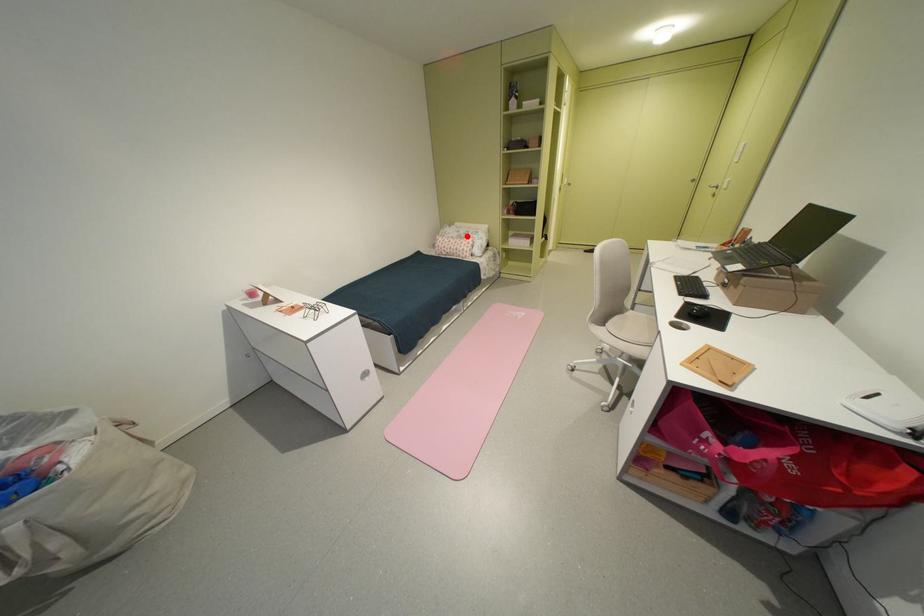
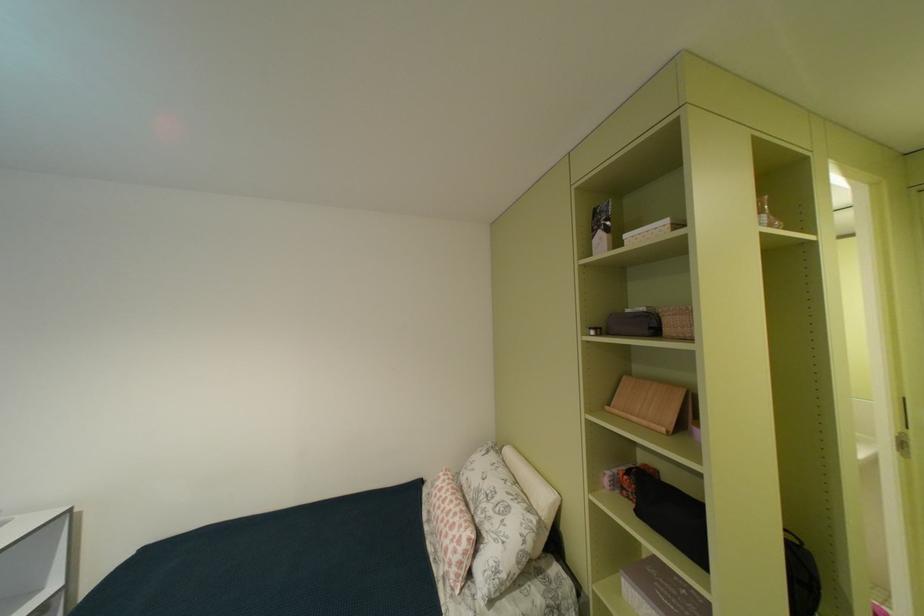
The point at the highlighted location is marked in the first image. Where is the corresponding point in the second image?

(487, 487)